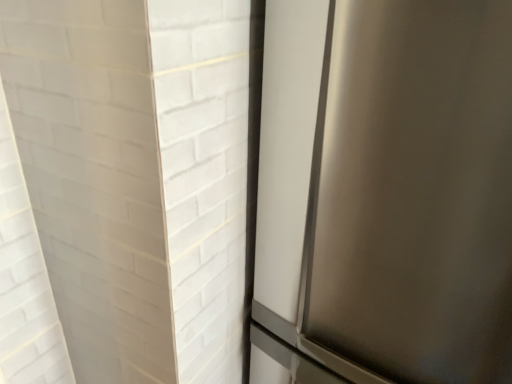
Question: In which direction should I rotate to look at stainless steel refrigerator door at center?

Choices:
 (A) right
 (B) left

Answer: (A)